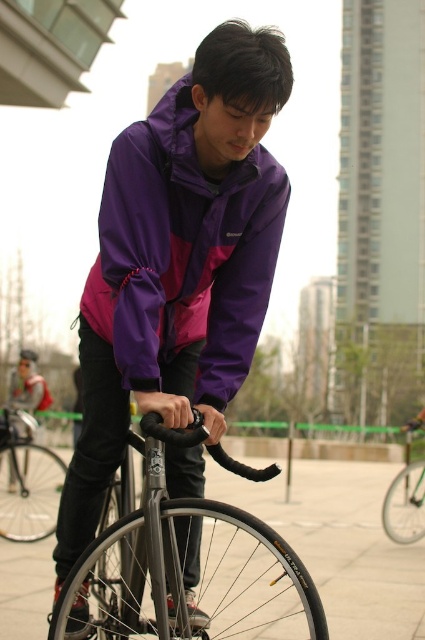
From the picture: You are a fashion designer observing the person in the image. They are wearing a purple matte jacket at center and a matte black jacket at center. Which jacket is positioned higher on their body?

The purple matte jacket at center is above the matte black jacket at center, so it is positioned higher on their body.